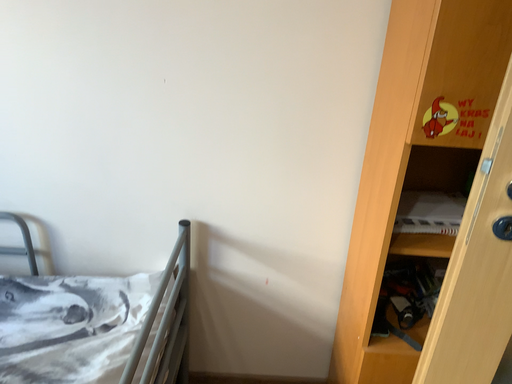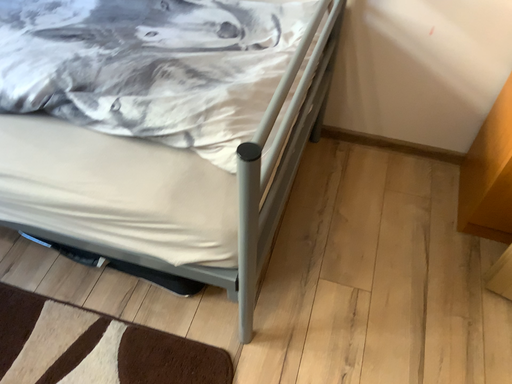
Question: How did the camera likely rotate when shooting the video?

Choices:
 (A) rotated upward
 (B) rotated downward

Answer: (B)